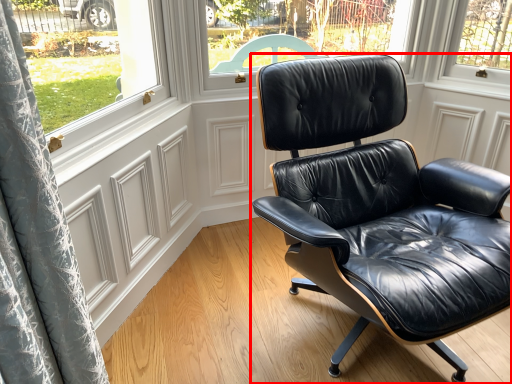
Question: From the image's perspective, what is the correct spatial positioning of chair (annotated by the red box) in reference to screen door?

Choices:
 (A) below
 (B) above

Answer: (B)